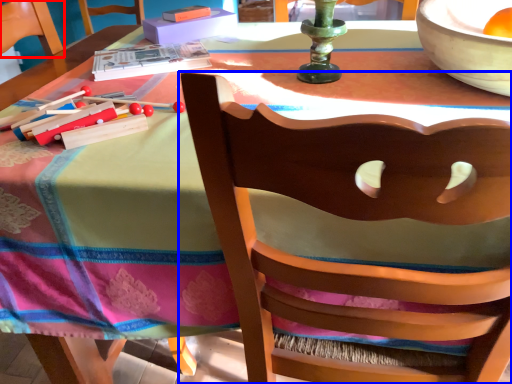
Question: Among these objects, which one is nearest to the camera, armchair (highlighted by a red box) or chair (highlighted by a blue box)?

Choices:
 (A) armchair
 (B) chair

Answer: (B)